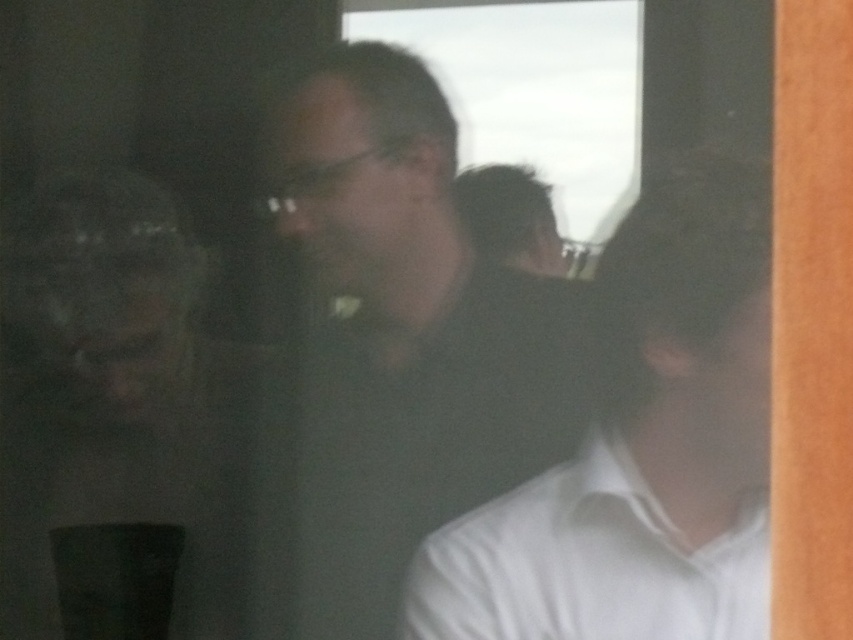
Does point (769, 246) lie behind point (762, 604)?

Yes.

Which is above, white matte shirt at center or white cotton dress shirt at lower right?

white matte shirt at center is above.

This screenshot has height=640, width=853. What do you see at coordinates (641, 449) in the screenshot? I see `white matte shirt at center` at bounding box center [641, 449].

I want to click on white matte shirt at center, so click(641, 449).

I want to click on matte black shirt at center, so click(x=402, y=332).

Can you confirm if matte black shirt at center is smaller than white cotton dress shirt at lower right?

Incorrect, matte black shirt at center is not smaller in size than white cotton dress shirt at lower right.

Is point (474, 323) positioned in front of point (442, 577)?

No, it is not.

This screenshot has height=640, width=853. What are the coordinates of `matte black shirt at center` in the screenshot? It's located at (402, 332).

Who is more distant from viewer, (442,403) or (624,368)?

The point (442,403) is behind.

In the scene shown: Measure the distance between point (x=548, y=394) and camera.

The distance of point (x=548, y=394) from camera is 4.49 feet.

I want to click on matte black shirt at center, so click(x=402, y=332).